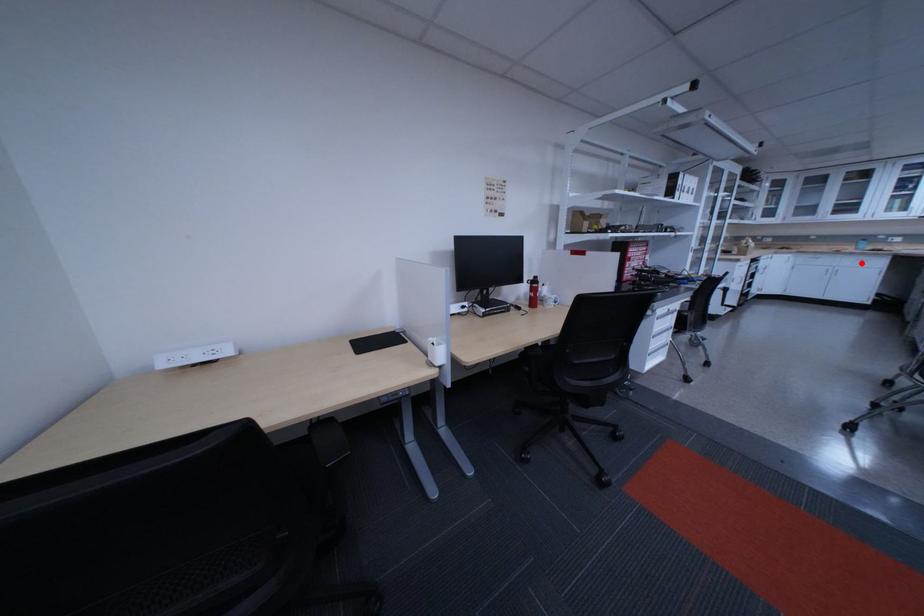
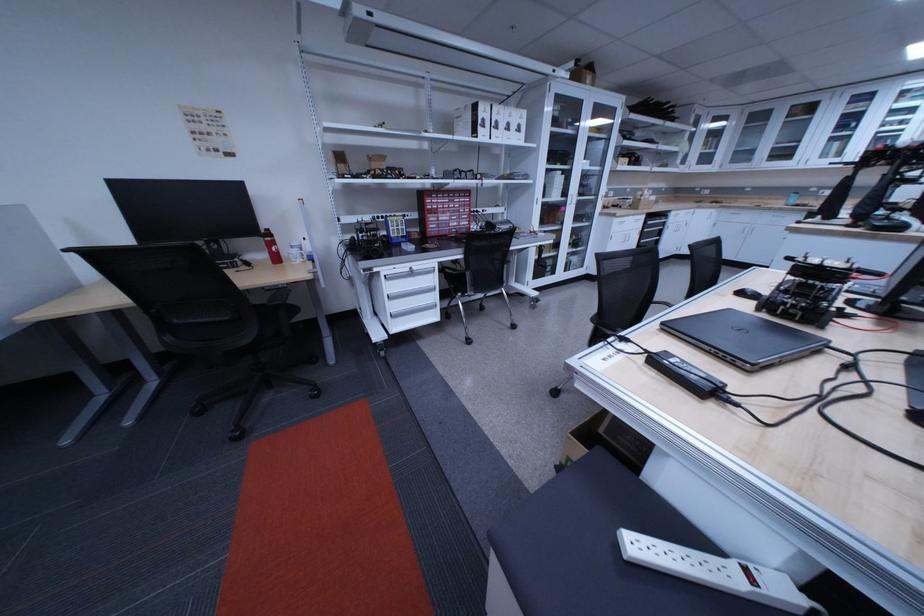
Question: I am providing you with two images of the same scene from different viewpoints. Image1 has a red point marked. In image2, the corresponding 3D location appears at what relative position? Reply with the corresponding letter.

Choices:
 (A) Closer
 (B) Farther

Answer: (A)